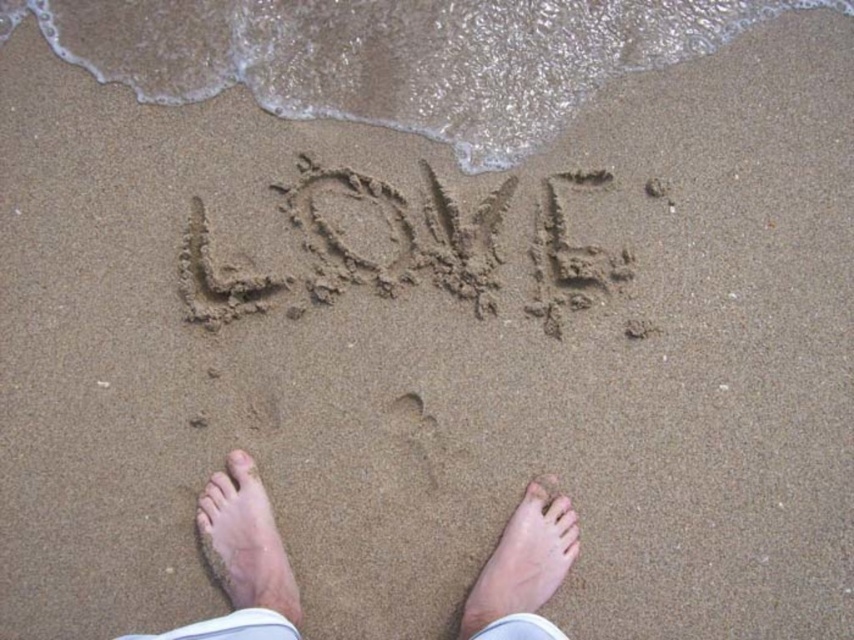
Question: Which object appears closest to the camera in this image?

Choices:
 (A) smooth skin foot at lower center
 (B) skin tone bare feet at center
 (C) light skin tone foot at lower center
 (D) dark brown sand at center

Answer: (B)

Question: Observing the image, what is the correct spatial positioning of skin tone bare feet at center in reference to smooth skin foot at lower center?

Choices:
 (A) right
 (B) left

Answer: (B)

Question: Considering the relative positions of light skin tone foot at lower center and smooth skin foot at lower center in the image provided, where is light skin tone foot at lower center located with respect to smooth skin foot at lower center?

Choices:
 (A) below
 (B) above

Answer: (B)

Question: Considering the real-world distances, which object is closest to the skin tone bare feet at center?

Choices:
 (A) light skin tone foot at lower center
 (B) smooth skin foot at lower center
 (C) dark brown sand at center

Answer: (A)

Question: Estimate the real-world distances between objects in this image. Which object is farther from the dark brown sand at center?

Choices:
 (A) light skin tone foot at lower center
 (B) skin tone bare feet at center

Answer: (B)

Question: Does dark brown sand at center appear on the right side of smooth skin foot at lower center?

Choices:
 (A) no
 (B) yes

Answer: (A)